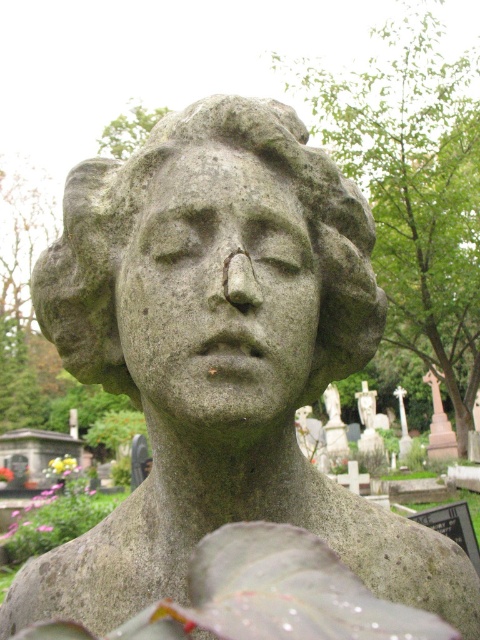
You are an archaeologist examining the image of a cemetery. You notice two objects labeled gray stone face at center and gray stone bust at center. Which of these two objects is shorter in height?

Result: The gray stone face at center is shorter in height compared to the gray stone bust at center.

Based on the scene description, what object is located at the coordinates point [218,291]?

The gray stone face at center is located at point [218,291].

You are an archaeologist examining the image of a cemetery. You notice two objects labeled gray stone face at center and gray stone bust at center. Which one has a larger size according to the description?

The gray stone bust at center is larger than the gray stone face at center.